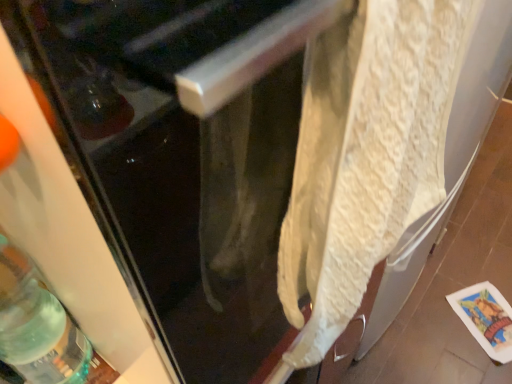
Question: Is translucent green glass bottle at lower left in contact with white textured towel at center?

Choices:
 (A) yes
 (B) no

Answer: (B)

Question: Is translucent green glass bottle at lower left bigger than white textured towel at center?

Choices:
 (A) yes
 (B) no

Answer: (B)

Question: Is white textured towel at center surrounded by translucent green glass bottle at lower left?

Choices:
 (A) yes
 (B) no

Answer: (B)

Question: From a real-world perspective, is translucent green glass bottle at lower left physically below white textured towel at center?

Choices:
 (A) yes
 (B) no

Answer: (A)

Question: Is the depth of translucent green glass bottle at lower left greater than that of white textured towel at center?

Choices:
 (A) yes
 (B) no

Answer: (A)

Question: In the image, is white textured towel at center positioned in front of or behind white textured towel at right?

Choices:
 (A) front
 (B) behind

Answer: (B)

Question: In terms of width, does white textured towel at center look wider or thinner when compared to white textured towel at right?

Choices:
 (A) thin
 (B) wide

Answer: (A)

Question: From a real-world perspective, relative to white textured towel at right, is white textured towel at center vertically above or below?

Choices:
 (A) above
 (B) below

Answer: (A)

Question: From the image's perspective, is white textured towel at center located above or below white textured towel at right?

Choices:
 (A) below
 (B) above

Answer: (A)

Question: In terms of height, does translucent green glass bottle at lower left look taller or shorter compared to white textured towel at center?

Choices:
 (A) short
 (B) tall

Answer: (A)

Question: Is translucent green glass bottle at lower left bigger or smaller than white textured towel at center?

Choices:
 (A) big
 (B) small

Answer: (B)

Question: From a real-world perspective, relative to white textured towel at center, is translucent green glass bottle at lower left vertically above or below?

Choices:
 (A) above
 (B) below

Answer: (B)

Question: From the image's perspective, is translucent green glass bottle at lower left positioned above or below white textured towel at center?

Choices:
 (A) below
 (B) above

Answer: (A)

Question: Is translucent green glass bottle at lower left wider or thinner than white textured towel at right?

Choices:
 (A) thin
 (B) wide

Answer: (A)

Question: Considering the positions of point (25, 304) and point (109, 130), is point (25, 304) closer or farther from the camera than point (109, 130)?

Choices:
 (A) farther
 (B) closer

Answer: (A)